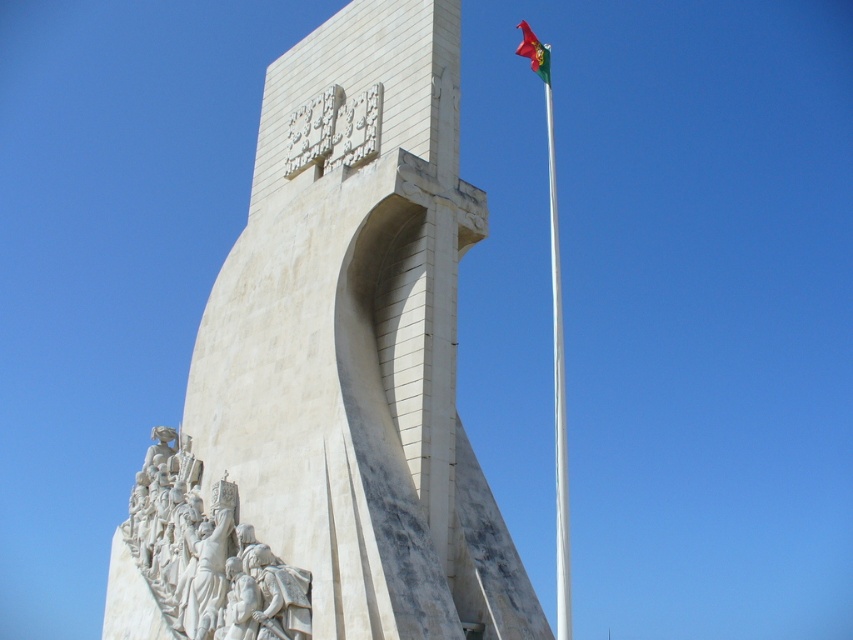
Who is taller, white marble monument at center or red fabric flag at upper right?

Standing taller between the two is red fabric flag at upper right.

Find the location of a particular element. white marble monument at center is located at coordinates (334, 372).

Describe the element at coordinates (334, 372) in the screenshot. The width and height of the screenshot is (853, 640). I see `white marble monument at center` at that location.

At what (x,y) coordinates should I click in order to perform the action: click on white marble monument at center. Please return your answer as a coordinate pair (x, y). The width and height of the screenshot is (853, 640). Looking at the image, I should click on [334, 372].

Is white marble monument at center taller than white marble relief at lower left?

Yes, white marble monument at center is taller than white marble relief at lower left.

Between point (482, 577) and point (184, 492), which one is positioned in front?

Point (482, 577)

At what (x,y) coordinates should I click in order to perform the action: click on white marble monument at center. Please return your answer as a coordinate pair (x, y). The height and width of the screenshot is (640, 853). Looking at the image, I should click on (334, 372).

This screenshot has width=853, height=640. What are the coordinates of `white marble monument at center` in the screenshot? It's located at (334, 372).

Between white marble relief at lower left and red fabric flag at upper right, which one is positioned lower?

white marble relief at lower left is lower down.

Does white marble relief at lower left come in front of red fabric flag at upper right?

That is True.

Between point (291, 576) and point (541, 68), which one is positioned in front?

Point (291, 576)

At what (x,y) coordinates should I click in order to perform the action: click on white marble relief at lower left. Please return your answer as a coordinate pair (x, y). Looking at the image, I should click on (207, 554).